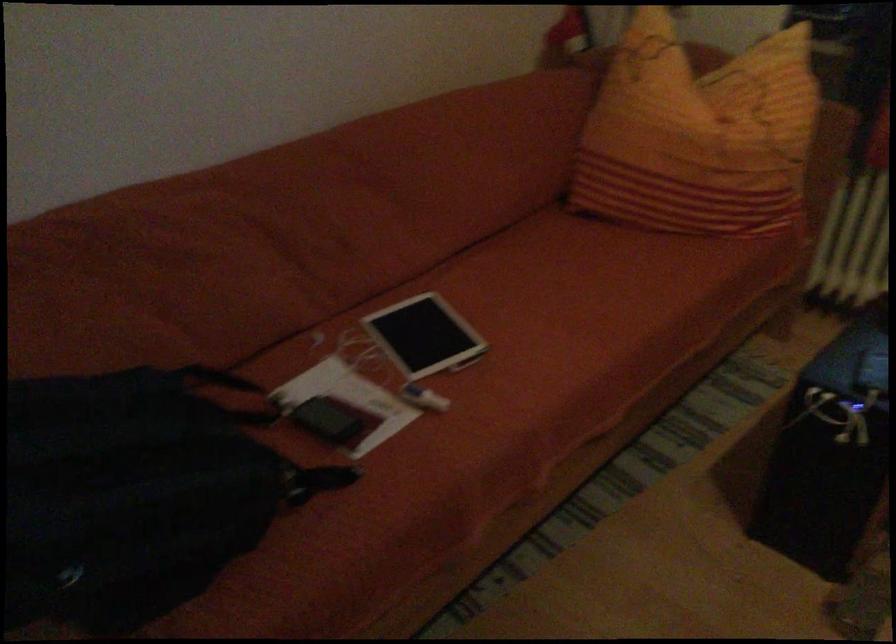
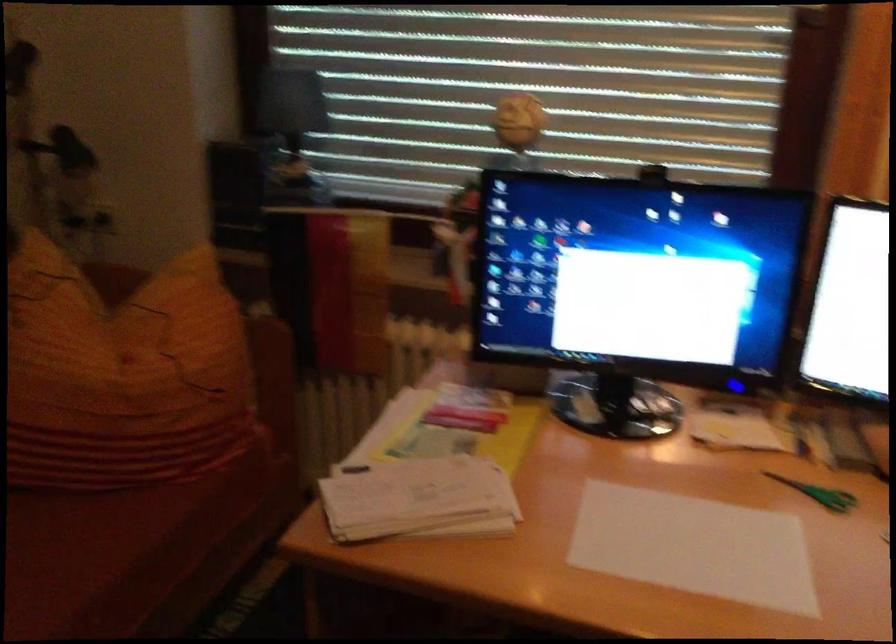
Question: The images are taken continuously from a first-person perspective. In which direction are you moving?

Choices:
 (A) Left
 (B) Right
 (C) Forward
 (D) Backward

Answer: (B)